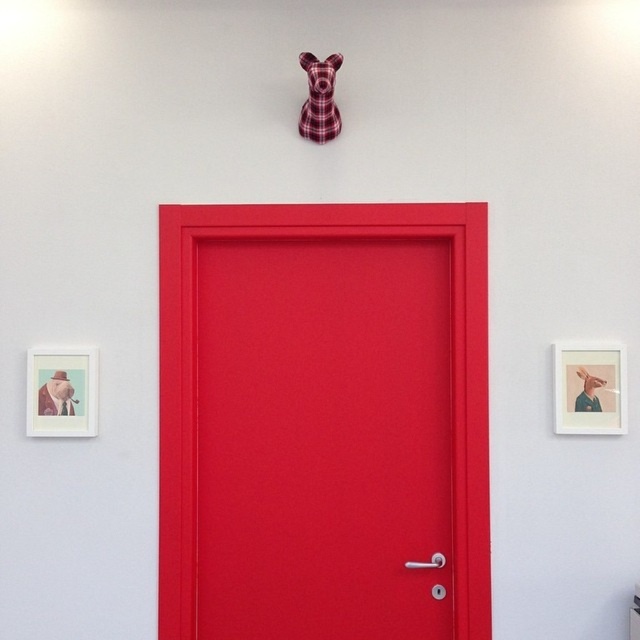
Question: Among these objects, which one is nearest to the camera?

Choices:
 (A) matte red door at center
 (B) matte black portrait at left
 (C) matte white picture frame at lower left

Answer: (A)

Question: Which object is positioned farthest from the matte black portrait at left?

Choices:
 (A) matte white picture frame at right
 (B) plaid fabric dog at upper center
 (C) matte white picture frame at lower left

Answer: (A)

Question: Is plaid fabric dog at upper center positioned at the back of matte black portrait at left?

Choices:
 (A) yes
 (B) no

Answer: (B)

Question: Where is matte white picture frame at lower left located in relation to plaid fabric dog at upper center in the image?

Choices:
 (A) above
 (B) below

Answer: (B)

Question: Which of the following is the farthest from the observer?

Choices:
 (A) (390, 275)
 (B) (596, 432)
 (C) (328, 61)

Answer: (A)

Question: Can you confirm if matte red door at center is wider than matte white picture frame at right?

Choices:
 (A) yes
 (B) no

Answer: (A)